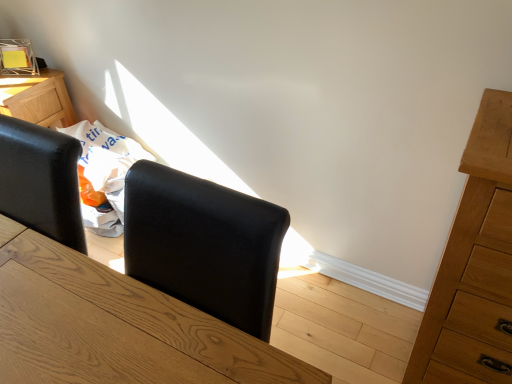
Question: Is black leather armchair at center inside the boundaries of natural wood dresser at right, or outside?

Choices:
 (A) inside
 (B) outside

Answer: (B)

Question: In terms of size, does black leather armchair at center appear bigger or smaller than natural wood dresser at right?

Choices:
 (A) small
 (B) big

Answer: (A)

Question: Is point (173, 193) positioned closer to the camera than point (431, 362)?

Choices:
 (A) closer
 (B) farther

Answer: (A)

Question: In the image, is natural wood dresser at right on the left side or the right side of black leather armchair at center?

Choices:
 (A) right
 (B) left

Answer: (A)

Question: Relative to black leather armchair at center, is natural wood dresser at right in front or behind?

Choices:
 (A) front
 (B) behind

Answer: (B)

Question: Considering the positions of natural wood dresser at right and black leather armchair at center in the image, is natural wood dresser at right taller or shorter than black leather armchair at center?

Choices:
 (A) tall
 (B) short

Answer: (A)

Question: From a real-world perspective, relative to black leather armchair at center, is natural wood dresser at right vertically above or below?

Choices:
 (A) below
 (B) above

Answer: (A)